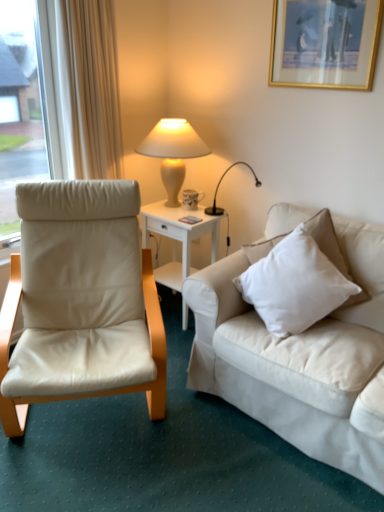
Locate an element on the screen. vacant area located to the right-hand side of beige leather chair at left is located at coordinates (228, 442).